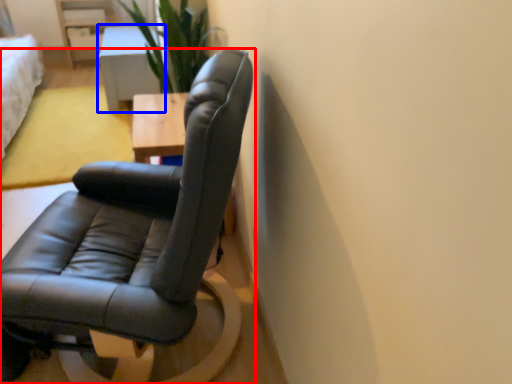
Question: Which point is further to the camera, chair (highlighted by a red box) or table (highlighted by a blue box)?

Choices:
 (A) chair
 (B) table

Answer: (B)